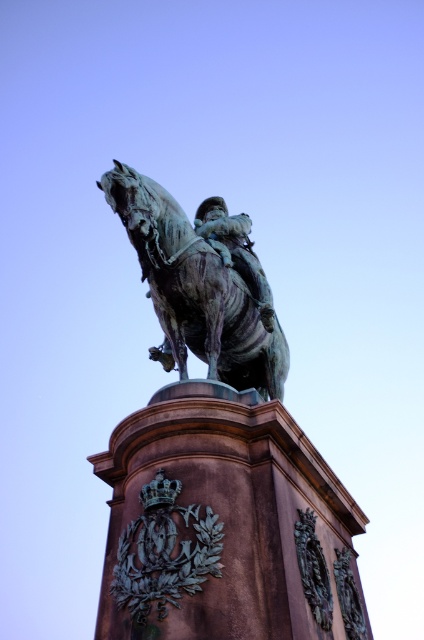
Question: Which point is closer to the camera taking this photo?

Choices:
 (A) (142, 540)
 (B) (159, 241)

Answer: (A)

Question: Among these objects, which one is nearest to the camera?

Choices:
 (A) bronze emblem at center
 (B) bronze/greenish patina horse at center

Answer: (A)

Question: Does bronze/greenish patina horse at center appear on the right side of bronze emblem at center?

Choices:
 (A) no
 (B) yes

Answer: (A)

Question: Does bronze/greenish patina horse at center appear on the right side of bronze emblem at center?

Choices:
 (A) yes
 (B) no

Answer: (B)

Question: Is bronze/greenish patina horse at center to the right of bronze emblem at center from the viewer's perspective?

Choices:
 (A) no
 (B) yes

Answer: (A)